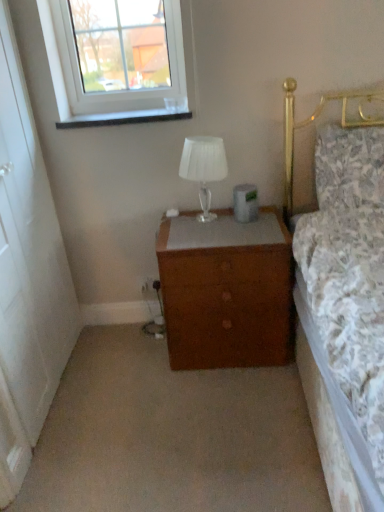
You are a GUI agent. You are given a task and a screenshot of the screen. Output one action in this format:
    pyautogui.click(x=<x>, y=<y>)
    Task: Click on the clear glass window at upper left
    This screenshot has height=512, width=384.
    Given the screenshot: What is the action you would take?
    pyautogui.click(x=123, y=90)

Where is `clear glass window at upper left`? This screenshot has width=384, height=512. clear glass window at upper left is located at coordinates [x=123, y=90].

Which object is further away from the camera, translucent glass lamp at center or floral fabric pillow at upper right?

Positioned behind is translucent glass lamp at center.

Is translucent glass lamp at center positioned with its back to floral fabric pillow at upper right?

No, translucent glass lamp at center is not facing the opposite direction of floral fabric pillow at upper right.

Who is bigger, translucent glass lamp at center or floral fabric pillow at upper right?

Bigger between the two is floral fabric pillow at upper right.

Considering the positions of objects translucent glass lamp at center and floral fabric pillow at upper right in the image provided, who is more to the right, translucent glass lamp at center or floral fabric pillow at upper right?

floral fabric pillow at upper right is more to the right.

From a real-world perspective, is brown wooden chest of drawers at center over clear glass window at upper left?

Actually, brown wooden chest of drawers at center is physically below clear glass window at upper left in the real world.

Can you confirm if brown wooden chest of drawers at center is thinner than clear glass window at upper left?

No, brown wooden chest of drawers at center is not thinner than clear glass window at upper left.

Where is `window lying above the brown wooden chest of drawers at center (from the image's perspective)`? The image size is (384, 512). window lying above the brown wooden chest of drawers at center (from the image's perspective) is located at coordinates (123, 90).

Does point (266, 319) lie in front of point (172, 64)?

Yes, point (266, 319) is closer to viewer.

Considering the relative sizes of clear glass window at upper left and brown wooden chest of drawers at center in the image provided, is clear glass window at upper left bigger than brown wooden chest of drawers at center?

Actually, clear glass window at upper left might be smaller than brown wooden chest of drawers at center.

Which is behind, clear glass window at upper left or brown wooden chest of drawers at center?

clear glass window at upper left is behind.

How far apart are clear glass window at upper left and brown wooden chest of drawers at center?

The distance of clear glass window at upper left from brown wooden chest of drawers at center is 33.25 inches.

From the image's perspective, is clear glass window at upper left above brown wooden chest of drawers at center?

Yes.

Which object is thinner, translucent glass lamp at center or clear glass window at upper left?

With smaller width is clear glass window at upper left.

Image resolution: width=384 pixels, height=512 pixels. I want to click on lamp on the right of clear glass window at upper left, so click(204, 168).

Does translucent glass lamp at center have a lesser height compared to clear glass window at upper left?

Yes.

From a real-world perspective, relative to clear glass window at upper left, is translucent glass lamp at center vertically above or below?

In terms of real-world spatial position, translucent glass lamp at center is below clear glass window at upper left.

Is clear glass window at upper left next to brown wooden chest of drawers at center and touching it?

clear glass window at upper left and brown wooden chest of drawers at center are clearly separated.

Who is smaller, clear glass window at upper left or brown wooden chest of drawers at center?

With smaller size is clear glass window at upper left.

Considering the sizes of objects clear glass window at upper left and brown wooden chest of drawers at center in the image provided, who is thinner, clear glass window at upper left or brown wooden chest of drawers at center?

clear glass window at upper left.

From the image's perspective, is clear glass window at upper left located above brown wooden chest of drawers at center?

Indeed, from the image's perspective, clear glass window at upper left is shown above brown wooden chest of drawers at center.

In the image, is translucent glass lamp at center positioned in front of or behind brown wooden chest of drawers at center?

Visually, translucent glass lamp at center is located behind brown wooden chest of drawers at center.

Find the location of `lamp that appears behind the brown wooden chest of drawers at center`. lamp that appears behind the brown wooden chest of drawers at center is located at coordinates coord(204,168).

From a real-world perspective, relative to brown wooden chest of drawers at center, is translucent glass lamp at center vertically above or below?

In terms of real-world spatial position, translucent glass lamp at center is above brown wooden chest of drawers at center.

Looking at this image, which of these two, translucent glass lamp at center or brown wooden chest of drawers at center, stands shorter?

translucent glass lamp at center is shorter.

From the image's perspective, does translucent glass lamp at center appear lower than brown wooden chest of drawers at center?

No.

Which object is positioned more to the left, translucent glass lamp at center or brown wooden chest of drawers at center?

translucent glass lamp at center.

Consider the image. Does translucent glass lamp at center have a lesser height compared to brown wooden chest of drawers at center?

Incorrect, the height of translucent glass lamp at center does not fall short of that of brown wooden chest of drawers at center.

Between point (215, 160) and point (145, 344), which one is positioned in front?

The point (215, 160) is closer.

The height and width of the screenshot is (512, 384). I want to click on lamp below the floral fabric pillow at upper right (from the image's perspective), so click(x=204, y=168).

You are a GUI agent. You are given a task and a screenshot of the screen. Output one action in this format:
    pyautogui.click(x=<x>, y=<y>)
    Task: Click on the window that appears on the left of brown wooden chest of drawers at center
    
    Given the screenshot: What is the action you would take?
    pyautogui.click(x=123, y=90)

Which object lies further to the anchor point clear glass window at upper left, floral fabric pillow at upper right or translucent glass lamp at center?

floral fabric pillow at upper right is positioned further to the anchor clear glass window at upper left.

Considering their positions, is translucent glass lamp at center positioned closer to brown wooden chest of drawers at center than brown wooden chest of drawers at center?

Among the two, brown wooden chest of drawers at center is located nearer to brown wooden chest of drawers at center.

Based on their spatial positions, is floral fabric pillow at upper right or brown wooden chest of drawers at center closer to brown wooden chest of drawers at center?

brown wooden chest of drawers at center is closer to brown wooden chest of drawers at center.

Based on their spatial positions, is brown wooden chest of drawers at center or clear glass window at upper left closer to translucent glass lamp at center?

The object closer to translucent glass lamp at center is brown wooden chest of drawers at center.

Based on their spatial positions, is brown wooden chest of drawers at center or brown wooden chest of drawers at center further from clear glass window at upper left?

Among the two, brown wooden chest of drawers at center is located further to clear glass window at upper left.

Which object lies further to the anchor point brown wooden chest of drawers at center, floral fabric pillow at upper right or clear glass window at upper left?

The object further to brown wooden chest of drawers at center is clear glass window at upper left.

Looking at this image, looking at the image, which one is located closer to floral fabric pillow at upper right, brown wooden chest of drawers at center or translucent glass lamp at center?

The object closer to floral fabric pillow at upper right is translucent glass lamp at center.

Considering their positions, is brown wooden chest of drawers at center positioned closer to floral fabric pillow at upper right than translucent glass lamp at center?

Based on the image, brown wooden chest of drawers at center appears to be nearer to floral fabric pillow at upper right.

At what (x,y) coordinates should I click in order to perform the action: click on lamp between clear glass window at upper left and brown wooden chest of drawers at center in the up-down direction. Please return your answer as a coordinate pair (x, y). This screenshot has width=384, height=512. Looking at the image, I should click on (204, 168).

This screenshot has width=384, height=512. Find the location of `lamp between clear glass window at upper left and brown wooden chest of drawers at center in the vertical direction`. lamp between clear glass window at upper left and brown wooden chest of drawers at center in the vertical direction is located at coordinates (204, 168).

Find the location of `lamp between clear glass window at upper left and floral fabric pillow at upper right from left to right`. lamp between clear glass window at upper left and floral fabric pillow at upper right from left to right is located at coordinates (204, 168).

Locate an element on the screen. This screenshot has width=384, height=512. pillow between clear glass window at upper left and brown wooden chest of drawers at center vertically is located at coordinates (349, 167).